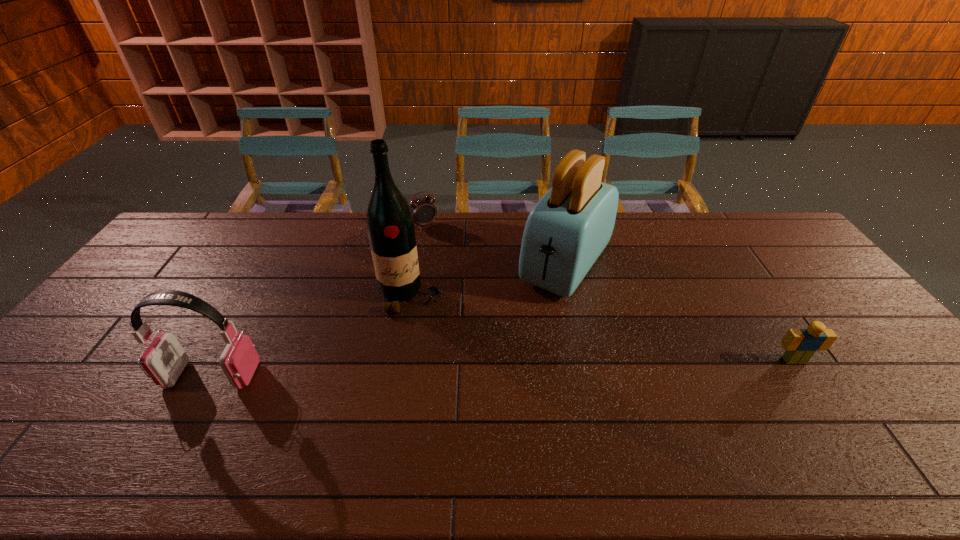
Locate an element on the screen. The height and width of the screenshot is (540, 960). the leftmost object is located at coordinates (164, 360).

Find the location of a particular element. Image resolution: width=960 pixels, height=540 pixels. earphone is located at coordinates (164, 360).

Identify the location of Lego. (800, 344).

You are a GUI agent. You are given a task and a screenshot of the screen. Output one action in this format:
    pyautogui.click(x=<x>, y=<y>)
    Task: Click on the fourth object from left to right
    
    Given the screenshot: What is the action you would take?
    pyautogui.click(x=566, y=231)

Identify the location of the second tallest object. (566, 231).

Identify the location of the farthest object. Image resolution: width=960 pixels, height=540 pixels. (424, 212).

Image resolution: width=960 pixels, height=540 pixels. In order to click on the tallest object in this screenshot , I will do `click(390, 225)`.

Identify the location of vacant point located on the outer surface of the third shortest object. (63, 375).

The image size is (960, 540). What are the coordinates of `blank space located 0.190m on the outer surface of the third shortest object` in the screenshot? It's located at (94, 375).

Find the location of a particular element. The width and height of the screenshot is (960, 540). vacant space located on the outer surface of the third shortest object is located at coordinates (52, 375).